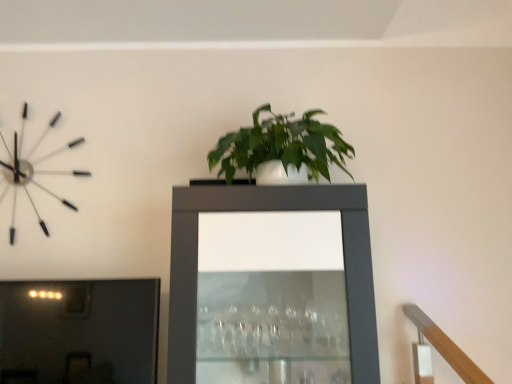
Question: Considering their positions, is matte black cabinet at center located in front of or behind metallic silver clock at upper left?

Choices:
 (A) behind
 (B) front

Answer: (B)

Question: Is matte black cabinet at center taller or shorter than metallic silver clock at upper left?

Choices:
 (A) tall
 (B) short

Answer: (A)

Question: Visually, is matte black cabinet at center positioned to the left or to the right of metallic silver clock at upper left?

Choices:
 (A) left
 (B) right

Answer: (B)

Question: From a real-world perspective, is metallic silver clock at upper left physically located above or below matte black cabinet at center?

Choices:
 (A) below
 (B) above

Answer: (B)

Question: Is metallic silver clock at upper left taller or shorter than matte black cabinet at center?

Choices:
 (A) short
 (B) tall

Answer: (A)

Question: Which is correct: metallic silver clock at upper left is inside matte black cabinet at center, or outside of it?

Choices:
 (A) outside
 (B) inside

Answer: (A)

Question: From the image's perspective, is metallic silver clock at upper left positioned above or below matte black cabinet at center?

Choices:
 (A) above
 (B) below

Answer: (A)